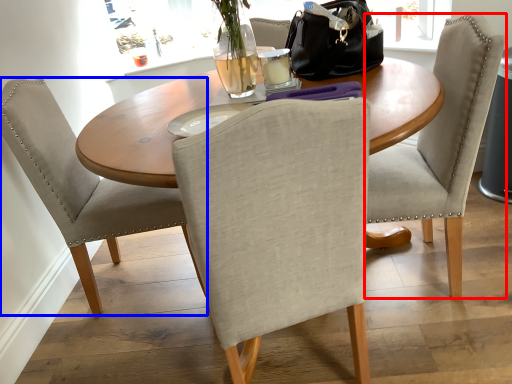
Question: Which point is closer to the camera, chair (highlighted by a red box) or chair (highlighted by a blue box)?

Choices:
 (A) chair
 (B) chair

Answer: (A)